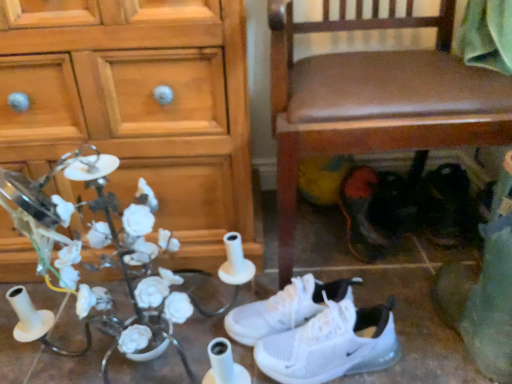
Question: From the image's perspective, is brown leather chair at lower right under white mesh sneakers at center, which is the 4th footwear in right-to-left order?

Choices:
 (A) yes
 (B) no

Answer: (B)

Question: From a real-world perspective, is brown leather chair at lower right beneath white mesh sneakers at center, which is the 4th footwear in right-to-left order?

Choices:
 (A) no
 (B) yes

Answer: (A)

Question: Considering the relative sizes of brown leather chair at lower right and white mesh sneakers at center, the 1th footwear from the left, in the image provided, is brown leather chair at lower right taller than white mesh sneakers at center, the 1th footwear from the left,?

Choices:
 (A) no
 (B) yes

Answer: (B)

Question: Is brown leather chair at lower right in front of white mesh sneakers at center, which is the 4th footwear in right-to-left order?

Choices:
 (A) yes
 (B) no

Answer: (A)

Question: Is brown leather chair at lower right looking in the opposite direction of white mesh sneakers at center, the 1th footwear from the left?

Choices:
 (A) no
 (B) yes

Answer: (A)

Question: Is brown leather chair at lower right smaller than white mesh sneakers at center, which is the 4th footwear in right-to-left order?

Choices:
 (A) no
 (B) yes

Answer: (A)

Question: From the image's perspective, does brown leather chair at lower right appear higher than white ceramic flowers at left?

Choices:
 (A) no
 (B) yes

Answer: (B)

Question: Is brown leather chair at lower right shorter than white ceramic flowers at left?

Choices:
 (A) yes
 (B) no

Answer: (B)

Question: From a real-world perspective, is brown leather chair at lower right positioned under white ceramic flowers at left based on gravity?

Choices:
 (A) yes
 (B) no

Answer: (B)

Question: Could white ceramic flowers at left be considered to be inside brown leather chair at lower right?

Choices:
 (A) no
 (B) yes

Answer: (A)

Question: Is brown leather chair at lower right oriented towards white ceramic flowers at left?

Choices:
 (A) no
 (B) yes

Answer: (A)

Question: Is brown leather chair at lower right directly adjacent to white ceramic flowers at left?

Choices:
 (A) yes
 (B) no

Answer: (B)

Question: From a real-world perspective, is black leather shoes at lower right, placed as the first footwear when sorted from right to left, over wooden cabinet at left?

Choices:
 (A) no
 (B) yes

Answer: (A)